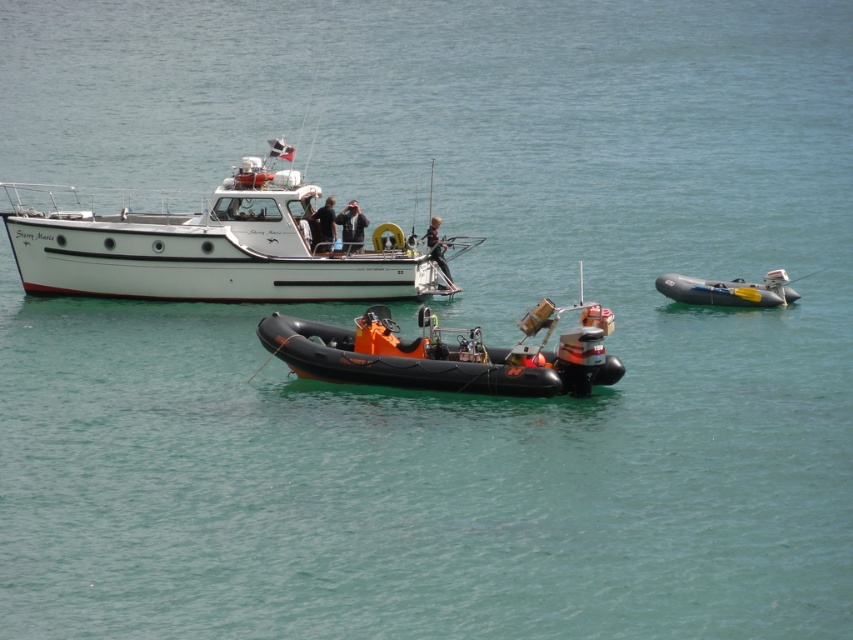
Is point (527, 358) positioned before point (451, 284)?

Yes, it is in front of point (451, 284).

Find the location of a particular element. black rubber dinghy at center is located at coordinates (442, 355).

You are a GUI agent. You are given a task and a screenshot of the screen. Output one action in this format:
    pyautogui.click(x=<x>, y=<y>)
    Task: Click on the black rubber dinghy at center
    Image resolution: width=853 pixels, height=640 pixels.
    Given the screenshot: What is the action you would take?
    pyautogui.click(x=442, y=355)

Who is more distant from viewer, (317, 250) or (440, 246)?

The point (440, 246) is behind.

Between black fabric jacket at upper center and black rubber wetsuit at center, which one appears on the left side from the viewer's perspective?

Positioned to the left is black fabric jacket at upper center.

Locate an element on the screen. The image size is (853, 640). black fabric jacket at upper center is located at coordinates (323, 227).

You are a GUI agent. You are given a task and a screenshot of the screen. Output one action in this format:
    pyautogui.click(x=<x>, y=<y>)
    Task: Click on the black fabric jacket at upper center
    The image size is (853, 640).
    Given the screenshot: What is the action you would take?
    pyautogui.click(x=323, y=227)

Is dark gray jacket at center thinner than black fabric jacket at upper center?

Indeed, dark gray jacket at center has a lesser width compared to black fabric jacket at upper center.

Image resolution: width=853 pixels, height=640 pixels. In order to click on dark gray jacket at center in this screenshot , I will do `click(351, 227)`.

Find the location of a particular element. This screenshot has height=640, width=853. dark gray jacket at center is located at coordinates (351, 227).